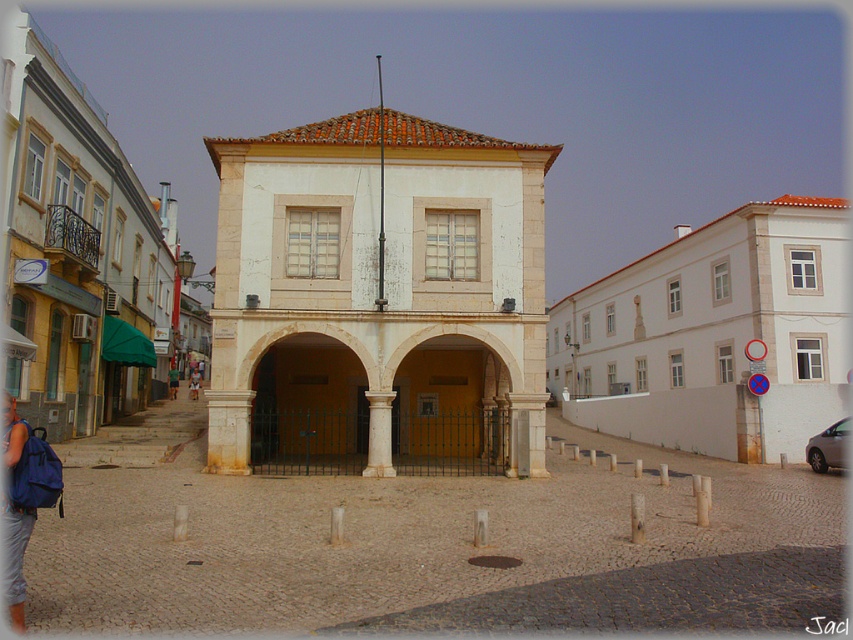
You are a tourist standing in the town square and see the white marble column at center and the green fabric bag at center. Which object is located to the right of the other?

The white marble column at center is positioned on the right side of green fabric bag at center.

You are a tourist standing in front of the historical building. You notice a white marble column at center and a brown leather bag at center. Which object is taller?

The white marble column at center is taller than the brown leather bag at center.

You are an architect examining the historical building in the image. You notice the brown stone archway at center and the white marble column at center. Which object is positioned further away from the viewer?

The white marble column at center is behind the brown stone archway at center, so it is positioned further away from the viewer.